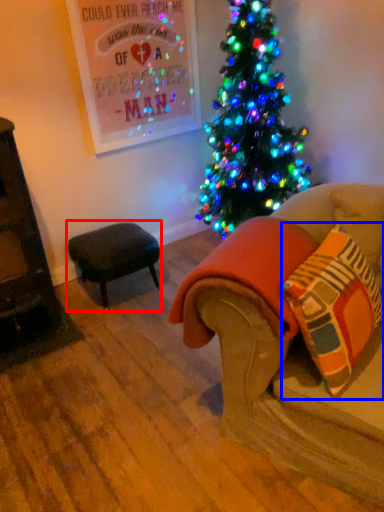
Question: Among these objects, which one is farthest to the camera, table (highlighted by a red box) or throw pillow (highlighted by a blue box)?

Choices:
 (A) table
 (B) throw pillow

Answer: (A)